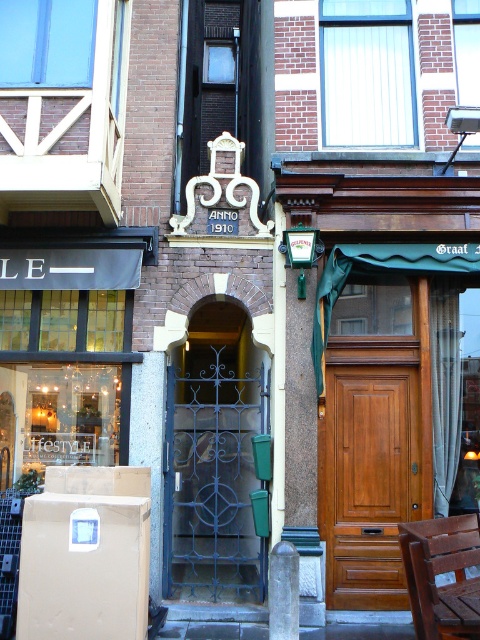
Based on the photo, you are a delivery person with a 36 inch wide package. You need to deliver it through either the wrought iron gate at center or the wooden door at center. Which one can the package fit through?

The wrought iron gate at center and wooden door at center are 38.38 inches apart from each other. Since the package is 36 inches wide, it can fit through either the wrought iron gate at center or the wooden door at center as the gap between them is wider than the package.

You are a delivery person trying to access the building. You see the wrought iron gate at center and the wooden door at center. Which object should you open first to enter the building?

You should open the wrought iron gate at center first because it is located below the wooden door at center, meaning it is the entrance point before reaching the door.